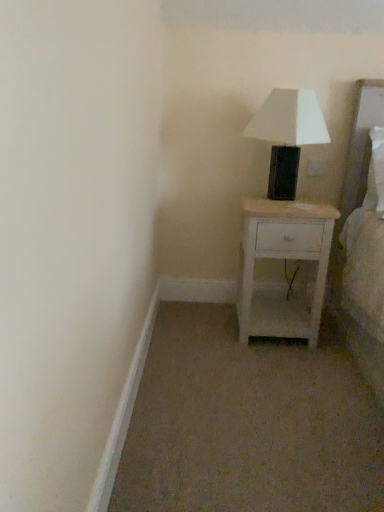
The width and height of the screenshot is (384, 512). Identify the location of free space to the left of white wood nightstand at center. (209, 330).